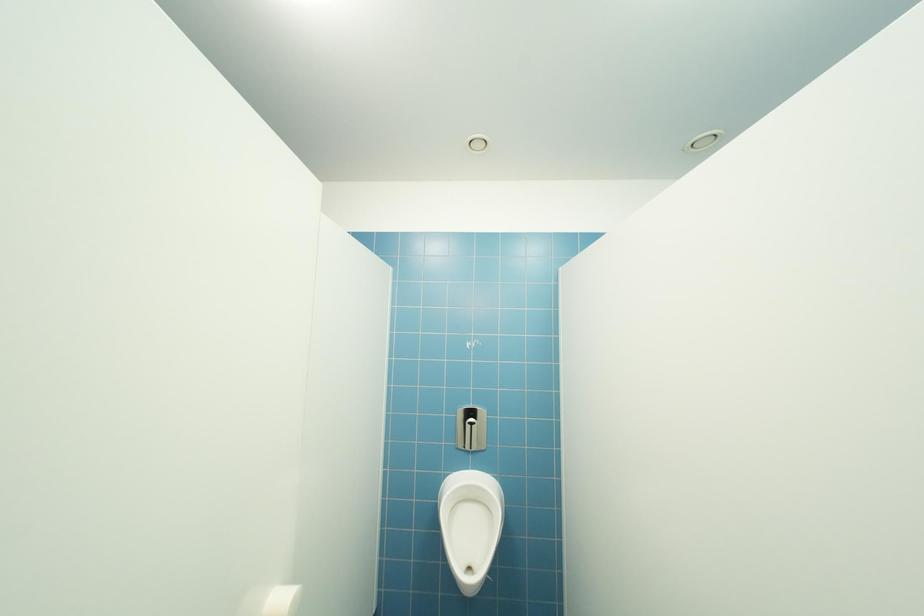
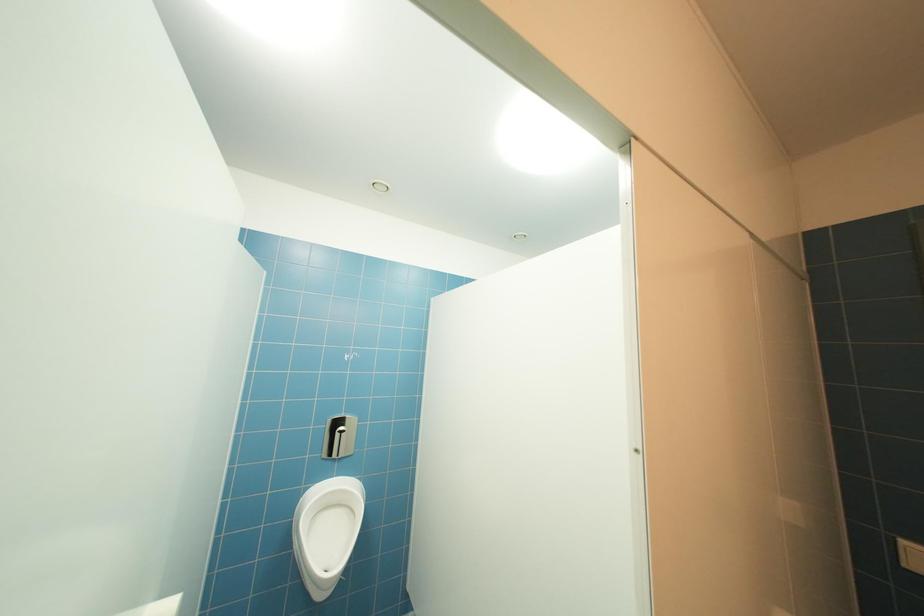
Question: Based on the continuous images, in which direction is the camera rotating? Reply with the corresponding letter.

Choices:
 (A) Left
 (B) Right
 (C) Up
 (D) Down

Answer: (B)